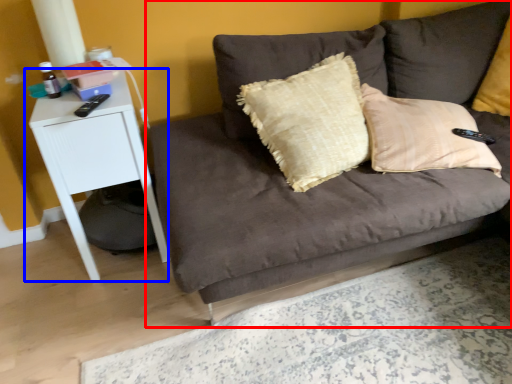
Question: Which object appears farthest to the camera in this image, studio couch (highlighted by a red box) or table (highlighted by a blue box)?

Choices:
 (A) studio couch
 (B) table

Answer: (B)